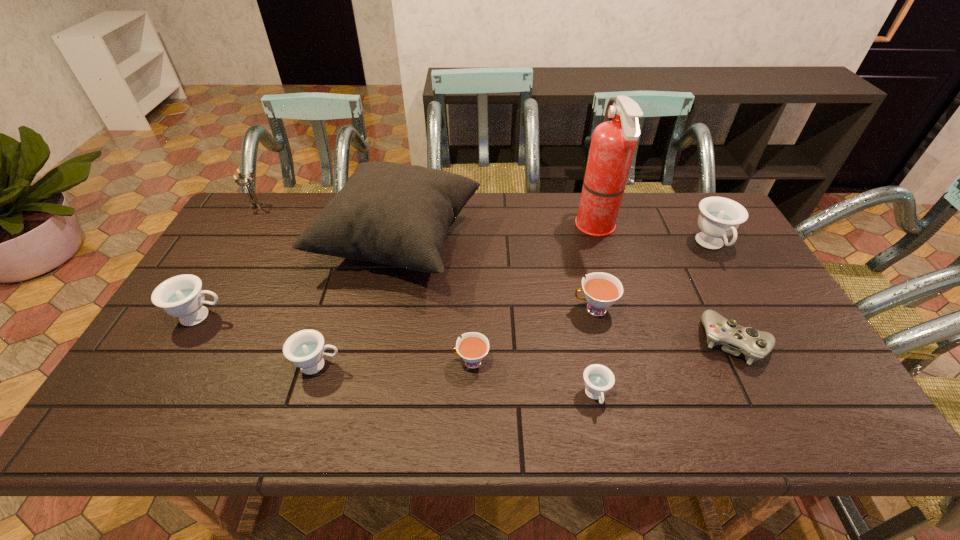
Find the location of a particular element. This screenshot has width=960, height=540. red fire extinguisher is located at coordinates (613, 143).

Locate an element on the screen. fire extinguisher is located at coordinates (613, 143).

Where is `cushion`? The height and width of the screenshot is (540, 960). cushion is located at coordinates (395, 214).

Identify the location of black cushion. The width and height of the screenshot is (960, 540). (395, 214).

The width and height of the screenshot is (960, 540). I want to click on candle holder, so click(x=254, y=201).

This screenshot has width=960, height=540. I want to click on the rightmost blue teacup, so pyautogui.click(x=719, y=217).

Identify the location of the biggest blue teacup. (719, 217).

Where is `the leftmost blue teacup`? the leftmost blue teacup is located at coordinates (181, 296).

The image size is (960, 540). I want to click on the third smallest blue teacup, so click(x=181, y=296).

Where is `the right white teacup`? the right white teacup is located at coordinates (601, 290).